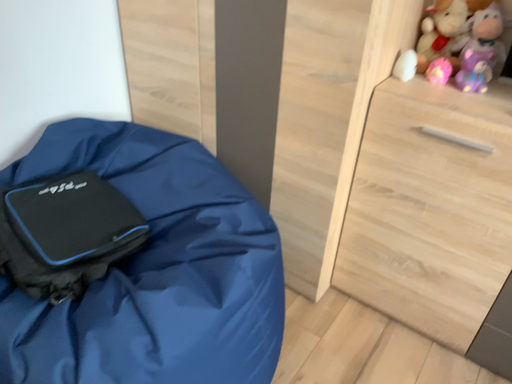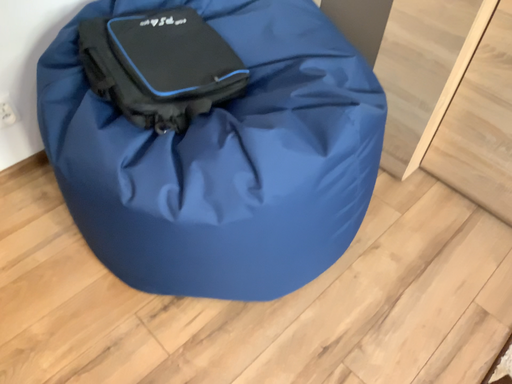
Question: Which way did the camera rotate in the video?

Choices:
 (A) rotated left
 (B) rotated right

Answer: (A)